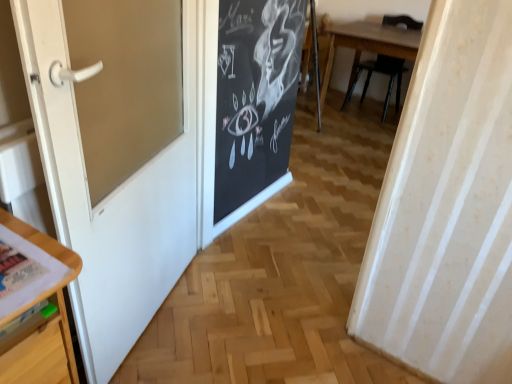
Question: From the image's perspective, is white glossy door at left positioned above or below wooden chair at upper right?

Choices:
 (A) above
 (B) below

Answer: (B)

Question: From their relative heights in the image, would you say white glossy door at left is taller or shorter than wooden chair at upper right?

Choices:
 (A) tall
 (B) short

Answer: (A)

Question: Based on their sizes in the image, would you say white glossy door at left is bigger or smaller than wooden chair at upper right?

Choices:
 (A) big
 (B) small

Answer: (B)

Question: Would you say wooden chair at upper right is to the left or to the right of white glossy door at left in the picture?

Choices:
 (A) right
 (B) left

Answer: (A)

Question: From their relative heights in the image, would you say wooden chair at upper right is taller or shorter than white glossy door at left?

Choices:
 (A) short
 (B) tall

Answer: (A)

Question: From a real-world perspective, is wooden chair at upper right above or below white glossy door at left?

Choices:
 (A) above
 (B) below

Answer: (B)

Question: Is wooden chair at upper right wider or thinner than white glossy door at left?

Choices:
 (A) wide
 (B) thin

Answer: (A)